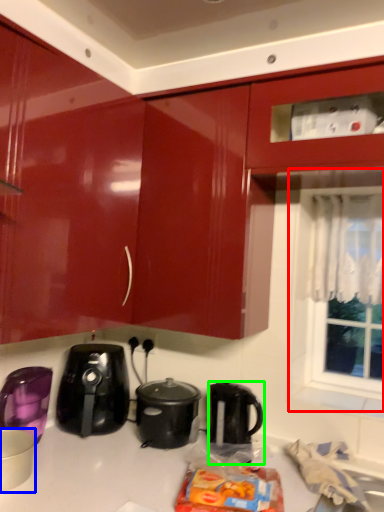
Question: Estimate the real-world distances between objects in this image. Which object is farther from window (highlighted by a red box), kitchen appliance (highlighted by a blue box) or kettle (highlighted by a green box)?

Choices:
 (A) kitchen appliance
 (B) kettle

Answer: (A)